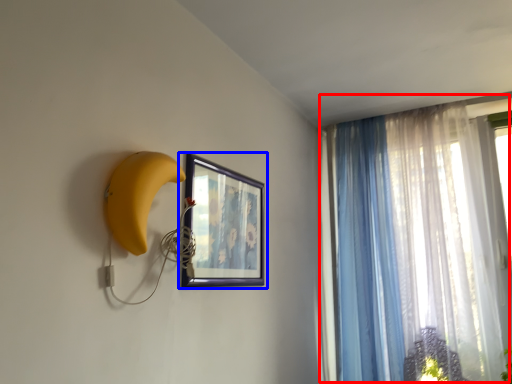
Question: Which point is further to the camera, curtain (highlighted by a red box) or picture frame (highlighted by a blue box)?

Choices:
 (A) curtain
 (B) picture frame

Answer: (A)